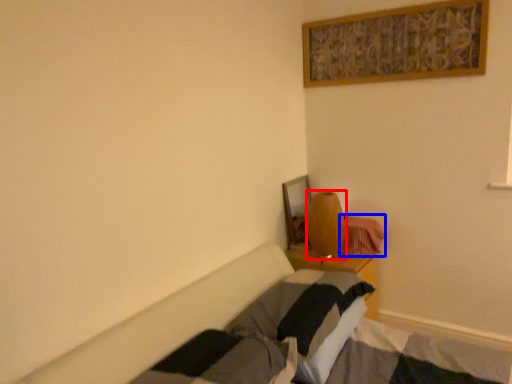
Question: Which object is closer to the camera taking this photo, lamp (highlighted by a red box) or blanket (highlighted by a blue box)?

Choices:
 (A) lamp
 (B) blanket

Answer: (A)